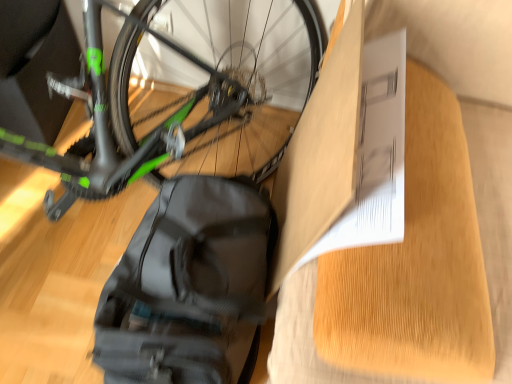
Question: From a real-world perspective, is black matte backpack at lower left positioned above or below white paper at upper right?

Choices:
 (A) below
 (B) above

Answer: (A)

Question: In the image, is black matte backpack at lower left on the left side or the right side of white paper at upper right?

Choices:
 (A) left
 (B) right

Answer: (A)

Question: Which is nearer to the matte cardboard box at center?

Choices:
 (A) white paper at upper right
 (B) black matte backpack at lower left

Answer: (A)

Question: Which of these objects is positioned closest to the black matte backpack at lower left?

Choices:
 (A) matte cardboard box at center
 (B) white paper at upper right

Answer: (A)